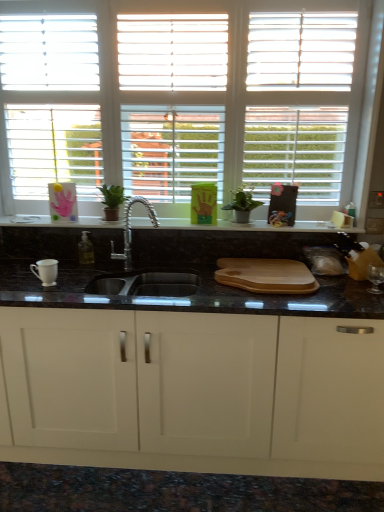
Question: Considering the relative sizes of white matte window at upper center and green matte plant at center in the image provided, is white matte window at upper center wider than green matte plant at center?

Choices:
 (A) yes
 (B) no

Answer: (B)

Question: Can you confirm if white matte window at upper center is shorter than green matte plant at center?

Choices:
 (A) no
 (B) yes

Answer: (A)

Question: Is white matte window at upper center far away from green matte plant at center?

Choices:
 (A) no
 (B) yes

Answer: (A)

Question: Is white matte window at upper center next to green matte plant at center?

Choices:
 (A) no
 (B) yes

Answer: (A)

Question: Is white matte window at upper center facing away from green matte plant at center?

Choices:
 (A) yes
 (B) no

Answer: (A)

Question: Is white matte window at upper center oriented towards green matte plant at center?

Choices:
 (A) no
 (B) yes

Answer: (B)

Question: From a real-world perspective, is polished chrome faucet at center physically above white matte window at upper center?

Choices:
 (A) yes
 (B) no

Answer: (B)

Question: Are polished chrome faucet at center and white matte window at upper center far apart?

Choices:
 (A) no
 (B) yes

Answer: (A)

Question: Does polished chrome faucet at center have a greater height compared to white matte window at upper center?

Choices:
 (A) yes
 (B) no

Answer: (B)

Question: Is polished chrome faucet at center outside white matte window at upper center?

Choices:
 (A) no
 (B) yes

Answer: (B)

Question: Could you tell me if polished chrome faucet at center is turned towards white matte window at upper center?

Choices:
 (A) yes
 (B) no

Answer: (B)

Question: Considering the relative positions of polished chrome faucet at center and white matte window at upper center in the image provided, is polished chrome faucet at center behind white matte window at upper center?

Choices:
 (A) yes
 (B) no

Answer: (B)

Question: Does green matte plant at center appear on the right side of white matte window at upper center?

Choices:
 (A) yes
 (B) no

Answer: (A)